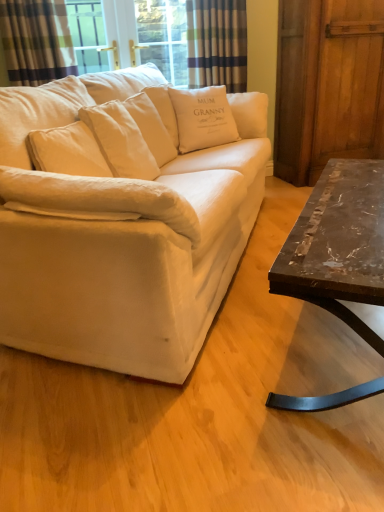
At what (x,y) coordinates should I click in order to perform the action: click on free spot below marble/black metal coffee table at right (from a real-world perspective). Please return your answer as a coordinate pair (x, y). Looking at the image, I should click on (327, 348).